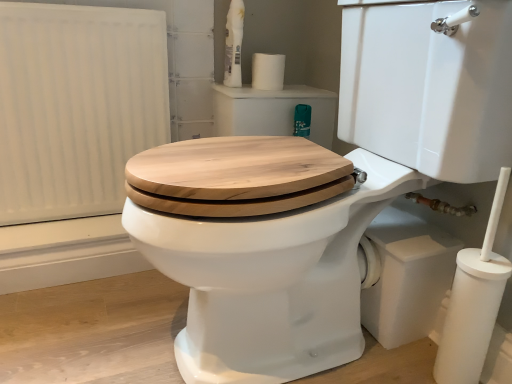
Describe the element at coordinates (234, 44) in the screenshot. The height and width of the screenshot is (384, 512). I see `white glossy spray bottle at upper center` at that location.

What do you see at coordinates (268, 71) in the screenshot? This screenshot has width=512, height=384. I see `white matte toilet paper at upper center` at bounding box center [268, 71].

Where is `white glossy spray bottle at upper center`? The image size is (512, 384). white glossy spray bottle at upper center is located at coordinates (234, 44).

Is white matte toilet paper at upper center behind white matte toilet paper at lower right?

Yes, white matte toilet paper at upper center is behind white matte toilet paper at lower right.

Does white matte toilet paper at upper center have a greater width compared to white matte toilet paper at lower right?

→ Yes.

In order to click on toilet paper on the left of white matte toilet paper at lower right in this screenshot , I will do `click(268, 71)`.

Looking at this image, could you tell me if white matte toilet paper at upper center is turned towards white matte toilet paper at lower right?

No, white matte toilet paper at upper center is not oriented towards white matte toilet paper at lower right.

Considering the points (31, 85) and (457, 368), which point is in front, point (31, 85) or point (457, 368)?

The point (457, 368) is closer to the camera.

Can you confirm if white matte radiator at left is wider than white matte toilet paper at lower right?

Yes.

Between white matte radiator at left and white matte toilet paper at lower right, which one is positioned in front?

white matte toilet paper at lower right.

From a real-world perspective, is white matte radiator at left below white matte toilet paper at lower right?

No, from a real-world perspective, white matte radiator at left is not beneath white matte toilet paper at lower right.

Between white glossy spray bottle at upper center and white matte toilet paper at lower right, which one has larger width?

Wider between the two is white glossy spray bottle at upper center.

From a real-world perspective, is white glossy spray bottle at upper center located beneath white matte toilet paper at lower right?

Incorrect, from a real-world perspective, white glossy spray bottle at upper center is higher than white matte toilet paper at lower right.

From the picture: Is white glossy spray bottle at upper center far away from white matte toilet paper at lower right?

That's not correct — white glossy spray bottle at upper center is a little close to white matte toilet paper at lower right.

From the image's perspective, between white glossy spray bottle at upper center and white matte toilet paper at lower right, who is located below?

From the image's view, white matte toilet paper at lower right is below.

Could you measure the distance between white matte toilet paper at upper center and white glossy spray bottle at upper center?

white matte toilet paper at upper center and white glossy spray bottle at upper center are 3.92 inches apart from each other.

Do you think white matte toilet paper at upper center is within white glossy spray bottle at upper center, or outside of it?

The correct answer is: outside.

Does white matte toilet paper at upper center lie in front of white glossy spray bottle at upper center?

No, it is behind white glossy spray bottle at upper center.

Where is `toiletry to the right of white matte radiator at left`? Image resolution: width=512 pixels, height=384 pixels. toiletry to the right of white matte radiator at left is located at coordinates (234, 44).

Are white matte radiator at left and white glossy spray bottle at upper center located far from each other?

They are positioned close to each other.

Is white matte radiator at left to the left of white glossy spray bottle at upper center from the viewer's perspective?

Indeed, white matte radiator at left is positioned on the left side of white glossy spray bottle at upper center.

Is white glossy spray bottle at upper center not near white matte radiator at left?

No, there isn't a large distance between white glossy spray bottle at upper center and white matte radiator at left.

Considering the positions of point (226, 58) and point (165, 107), is point (226, 58) closer or farther from the camera than point (165, 107)?

Clearly, point (226, 58) is more distant from the camera than point (165, 107).

From the image's perspective, is white glossy spray bottle at upper center beneath white matte radiator at left?

Incorrect, from the image's perspective, white glossy spray bottle at upper center is higher than white matte radiator at left.

Measure the distance between white glossy spray bottle at upper center and white matte radiator at left.

white glossy spray bottle at upper center and white matte radiator at left are 43.91 centimeters apart from each other.

From the image's perspective, which one is positioned lower, white matte radiator at left or white matte toilet paper at upper center?

white matte radiator at left is shown below in the image.

From a real-world perspective, is white matte radiator at left physically below white matte toilet paper at upper center?

Yes, from a real-world perspective, white matte radiator at left is below white matte toilet paper at upper center.

Considering the relative sizes of white matte radiator at left and white matte toilet paper at upper center in the image provided, is white matte radiator at left thinner than white matte toilet paper at upper center?

Indeed, white matte radiator at left has a lesser width compared to white matte toilet paper at upper center.

Which of these two, white matte radiator at left or white matte toilet paper at upper center, stands taller?

white matte radiator at left.

Identify the location of toilet paper above the white matte toilet paper at lower right (from the image's perspective). (268, 71).

This screenshot has height=384, width=512. What are the coordinates of `pillar in front of the white matte radiator at left` in the screenshot? It's located at (471, 315).

Considering their positions, is white matte toilet paper at lower right positioned further to white glossy spray bottle at upper center than white matte toilet paper at upper center?

white matte toilet paper at lower right.

Considering their positions, is white matte toilet paper at upper center positioned further to white matte radiator at left than white glossy spray bottle at upper center?

white matte toilet paper at upper center.

Considering their positions, is white glossy spray bottle at upper center positioned closer to white matte toilet paper at lower right than white matte radiator at left?

Among the two, white glossy spray bottle at upper center is located nearer to white matte toilet paper at lower right.

Based on the photo, based on their spatial positions, is white matte toilet paper at lower right or white matte toilet paper at upper center closer to white matte radiator at left?

white matte toilet paper at upper center is positioned closer to the anchor white matte radiator at left.

Which object lies further to the anchor point white matte toilet paper at lower right, white matte toilet paper at upper center or white matte radiator at left?

white matte radiator at left is positioned further to the anchor white matte toilet paper at lower right.

Considering their positions, is white glossy spray bottle at upper center positioned closer to white matte toilet paper at lower right than white matte toilet paper at upper center?

Based on the image, white matte toilet paper at upper center appears to be nearer to white matte toilet paper at lower right.

Based on the photo, which object lies nearer to the anchor point white glossy spray bottle at upper center, white matte radiator at left or white matte toilet paper at lower right?

Based on the image, white matte radiator at left appears to be nearer to white glossy spray bottle at upper center.

Looking at the image, which one is located further to white matte toilet paper at upper center, white matte toilet paper at lower right or white glossy spray bottle at upper center?

Based on the image, white matte toilet paper at lower right appears to be further to white matte toilet paper at upper center.

The height and width of the screenshot is (384, 512). I want to click on toiletry located between white matte radiator at left and white matte toilet paper at upper center in the left-right direction, so click(x=234, y=44).

Where is `toiletry between white matte radiator at left and white matte toilet paper at lower right`? This screenshot has width=512, height=384. toiletry between white matte radiator at left and white matte toilet paper at lower right is located at coordinates (234, 44).

You are a GUI agent. You are given a task and a screenshot of the screen. Output one action in this format:
    pyautogui.click(x=<x>, y=<y>)
    Task: Click on the toilet paper between white glossy spray bottle at upper center and white matte toilet paper at lower right from top to bottom
    This screenshot has width=512, height=384.
    Given the screenshot: What is the action you would take?
    pyautogui.click(x=268, y=71)

You are a GUI agent. You are given a task and a screenshot of the screen. Output one action in this format:
    pyautogui.click(x=<x>, y=<y>)
    Task: Click on the toilet paper located between white matte radiator at left and white matte toilet paper at lower right in the left-right direction
    The image size is (512, 384).
    Given the screenshot: What is the action you would take?
    268,71